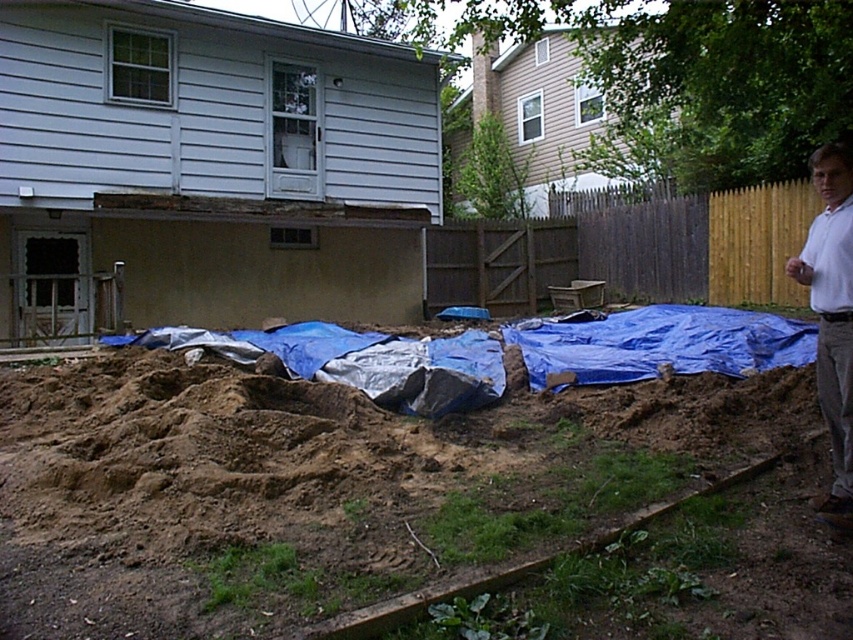
You are standing in the backyard and want to place a 12 feet long ladder against the house. The brown soil at lower left is where you want to position the ladder. Is there enough space between you and the soil to safely place the ladder?

The distance between you and the brown soil at lower left is 14.25 feet, which is greater than the ladder length of 12 feet. Therefore, there is enough space to safely place the ladder there.

You are standing in the backyard and see the brown soil at lower left and the white cotton shirt at right. Which object is positioned more to the left side of the scene?

The brown soil at lower left is positioned more to the left side of the scene than the white cotton shirt at right.

You are a worker in the backyard and need to determine if the brown soil at lower left is higher than the white cotton shirt at right. Based on the scene, what can you conclude?

The brown soil at lower left is not as tall as the white cotton shirt at right, so the soil is lower in height compared to the shirt.